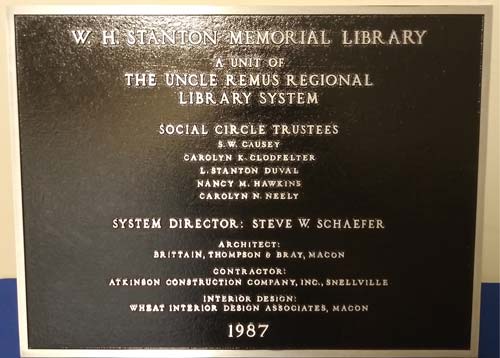
The height and width of the screenshot is (358, 500). I want to click on wood frame, so click(16, 135), click(479, 167).